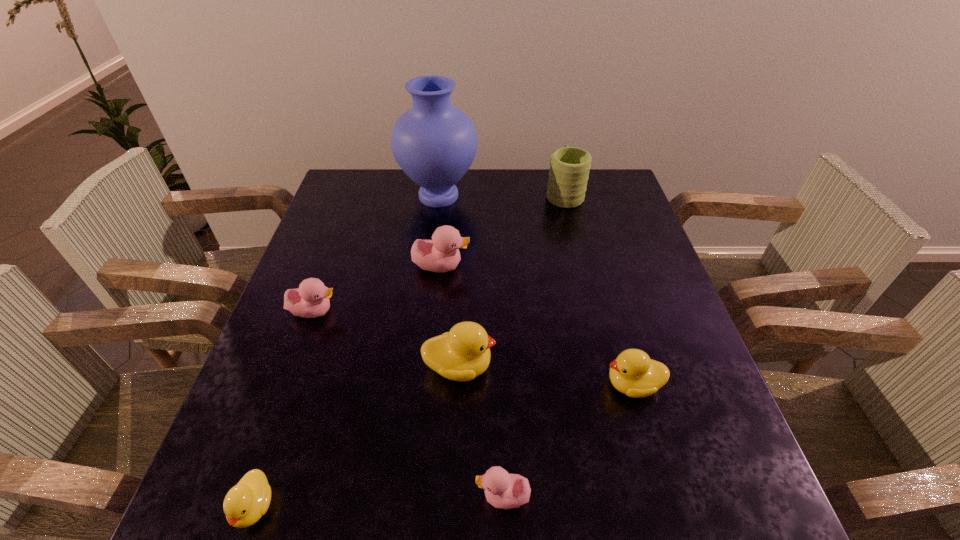
I want to click on the tallest object, so click(434, 143).

Identify the location of vase. (434, 143).

Where is `green mug`? green mug is located at coordinates (569, 167).

In order to click on the second pink duckling from right to left in this screenshot , I will do `click(441, 254)`.

Where is `the biggest pink duckling`? the biggest pink duckling is located at coordinates click(441, 254).

Locate an element on the screen. This screenshot has height=540, width=960. the second yellow duckling from right to left is located at coordinates (463, 353).

Find the location of `the second nearest pink duckling`. the second nearest pink duckling is located at coordinates (311, 300).

Find the location of a particular element. The height and width of the screenshot is (540, 960). the fifth nearest duckling is located at coordinates (311, 300).

Locate an element on the screen. the rightmost yellow duckling is located at coordinates (633, 373).

You are a GUI agent. You are given a task and a screenshot of the screen. Output one action in this format:
    pyautogui.click(x=<x>, y=<y>)
    Task: Click on the rightmost duckling
    Image resolution: width=960 pixels, height=540 pixels.
    Given the screenshot: What is the action you would take?
    pyautogui.click(x=633, y=373)